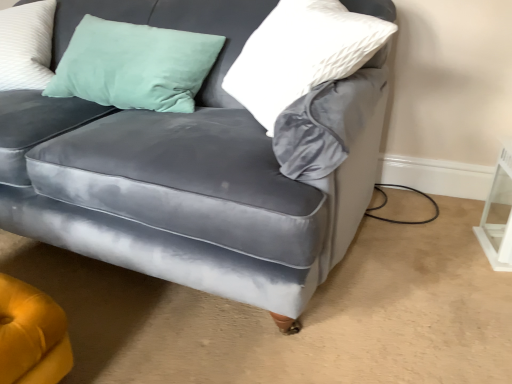
Question: From the image's perspective, is velvet gray couch at center located above or below white glossy table at lower right?

Choices:
 (A) below
 (B) above

Answer: (B)

Question: Is velvet gray couch at center to the left or to the right of white glossy table at lower right in the image?

Choices:
 (A) right
 (B) left

Answer: (B)

Question: Which is nearer to the velvet gray couch at center?

Choices:
 (A) white glossy table at lower right
 (B) white textured pillow at upper right

Answer: (B)

Question: Which is nearer to the velvet gray couch at center?

Choices:
 (A) white glossy table at lower right
 (B) white textured pillow at upper right

Answer: (B)